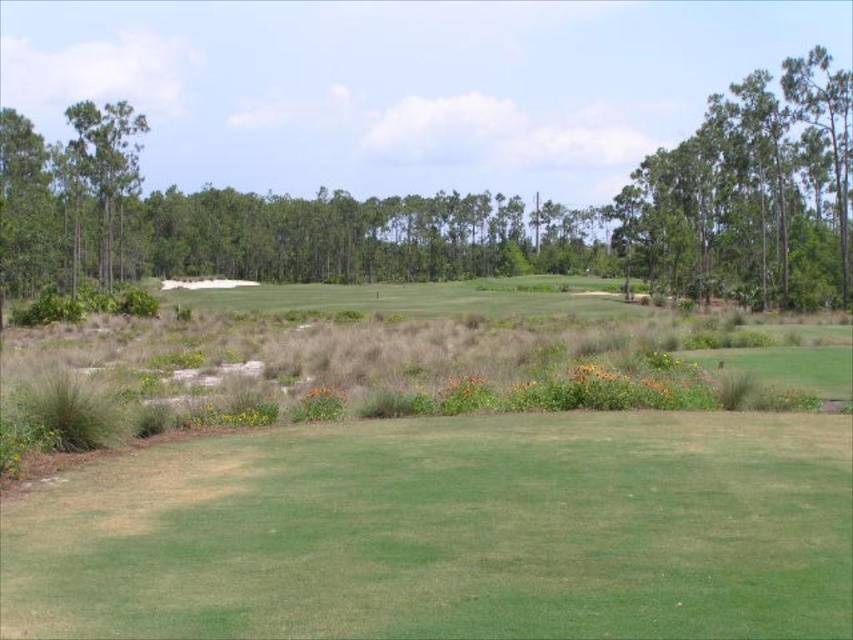
You are a golfer standing on the fairway and want to hit the ball towards the green. There are two groups of trees in your line of sight. The green leafy tree at upper center and the green leafy trees at upper right. Which group of trees is closer to your current position?

The green leafy tree at upper center is positioned under the green leafy trees at upper right, meaning it is closer to your current position on the fairway.

You are a golfer standing on the green grassy field at center and want to hit the ball towards the green leafy tree at left. Considering the width of both areas, which one is wider?

The green grassy field at center is wider than the green leafy tree at left, so the field is wider.